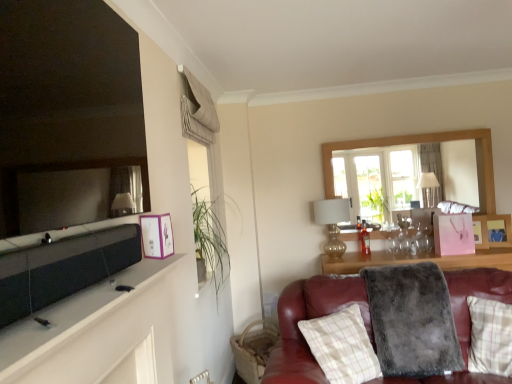
Question: Is purple paper picture frame at upper left, which appears as the second picture frame when viewed from the right, with matte black mirror at upper left?

Choices:
 (A) no
 (B) yes

Answer: (A)

Question: Is purple paper picture frame at upper left, which ranks as the second picture frame in back-to-front order, smaller than matte black mirror at upper left?

Choices:
 (A) yes
 (B) no

Answer: (A)

Question: Can you confirm if purple paper picture frame at upper left, which ranks as the second picture frame in back-to-front order, is taller than matte black mirror at upper left?

Choices:
 (A) no
 (B) yes

Answer: (A)

Question: Is matte black mirror at upper left inside purple paper picture frame at upper left, which appears as the second picture frame when viewed from the right?

Choices:
 (A) yes
 (B) no

Answer: (B)

Question: Considering the relative sizes of purple paper picture frame at upper left, which ranks as the second picture frame in back-to-front order, and matte black mirror at upper left in the image provided, is purple paper picture frame at upper left, which ranks as the second picture frame in back-to-front order, bigger than matte black mirror at upper left?

Choices:
 (A) no
 (B) yes

Answer: (A)

Question: Would you say gray fluffy blanket at lower right is to the left or to the right of wooden frame window at upper right in the picture?

Choices:
 (A) left
 (B) right

Answer: (A)

Question: Is gray fluffy blanket at lower right taller or shorter than wooden frame window at upper right?

Choices:
 (A) short
 (B) tall

Answer: (A)

Question: Is gray fluffy blanket at lower right wider or thinner than wooden frame window at upper right?

Choices:
 (A) wide
 (B) thin

Answer: (A)

Question: Considering the positions of point (375, 345) and point (478, 185), is point (375, 345) closer or farther from the camera than point (478, 185)?

Choices:
 (A) closer
 (B) farther

Answer: (A)

Question: Based on their sizes in the image, would you say gold metallic lamp at upper right is bigger or smaller than gray fluffy blanket at lower right?

Choices:
 (A) small
 (B) big

Answer: (A)

Question: Relative to gray fluffy blanket at lower right, is gold metallic lamp at upper right in front or behind?

Choices:
 (A) behind
 (B) front

Answer: (A)

Question: From a real-world perspective, is gold metallic lamp at upper right positioned above or below gray fluffy blanket at lower right?

Choices:
 (A) above
 (B) below

Answer: (A)

Question: In the image, is gold metallic lamp at upper right on the left side or the right side of gray fluffy blanket at lower right?

Choices:
 (A) left
 (B) right

Answer: (A)

Question: Considering their positions, is gold metallic lamp at upper right located in front of or behind brown woven basket at lower right?

Choices:
 (A) front
 (B) behind

Answer: (B)

Question: In terms of size, does gold metallic lamp at upper right appear bigger or smaller than brown woven basket at lower right?

Choices:
 (A) small
 (B) big

Answer: (A)